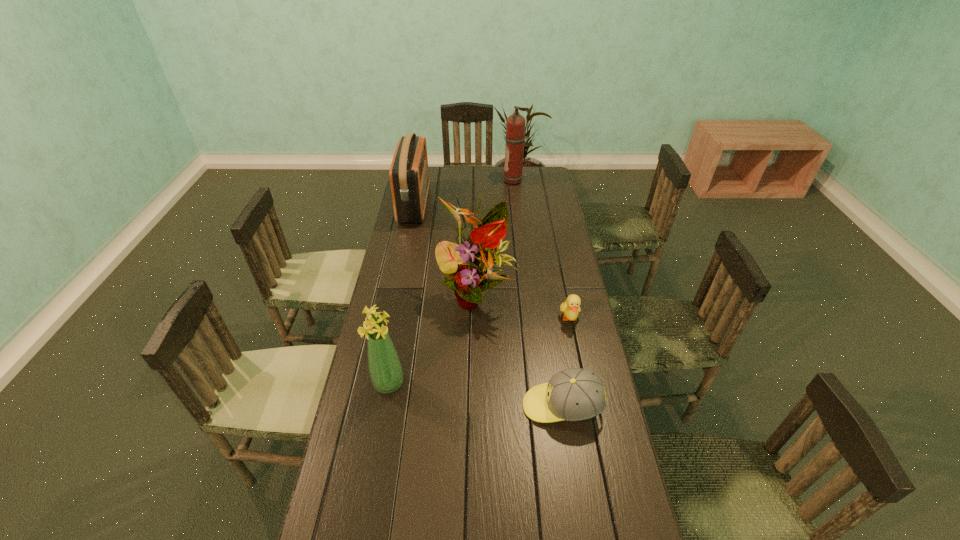
You are a GUI agent. You are given a task and a screenshot of the screen. Output one action in this format:
    pyautogui.click(x=<x>, y=<y>)
    Task: Click on the fire extinguisher that is at the right edge
    This screenshot has width=960, height=540.
    Given the screenshot: What is the action you would take?
    point(515,125)

Image resolution: width=960 pixels, height=540 pixels. I want to click on baseball cap present at the right edge, so click(x=575, y=394).

Find the location of a particular element. The height and width of the screenshot is (540, 960). duckling positioned at the right edge is located at coordinates (571, 307).

I want to click on object that is at the far left corner, so [409, 174].

Locate an element on the screen. Image resolution: width=960 pixels, height=540 pixels. object that is at the far right corner is located at coordinates (515, 125).

Where is `free region at the left edge`? This screenshot has width=960, height=540. free region at the left edge is located at coordinates (364, 360).

In the image, there is a desktop. In order to click on vacant space at the right edge in this screenshot , I will do (581, 351).

Locate an element on the screen. vacant position at the far right corner of the desktop is located at coordinates (541, 184).

The width and height of the screenshot is (960, 540). Find the location of `vacant space that is in between the fire extinguisher and the radio receiver`. vacant space that is in between the fire extinguisher and the radio receiver is located at coordinates (465, 193).

The width and height of the screenshot is (960, 540). What are the coordinates of `free area in between the duckling and the right bouquet` in the screenshot? It's located at (523, 307).